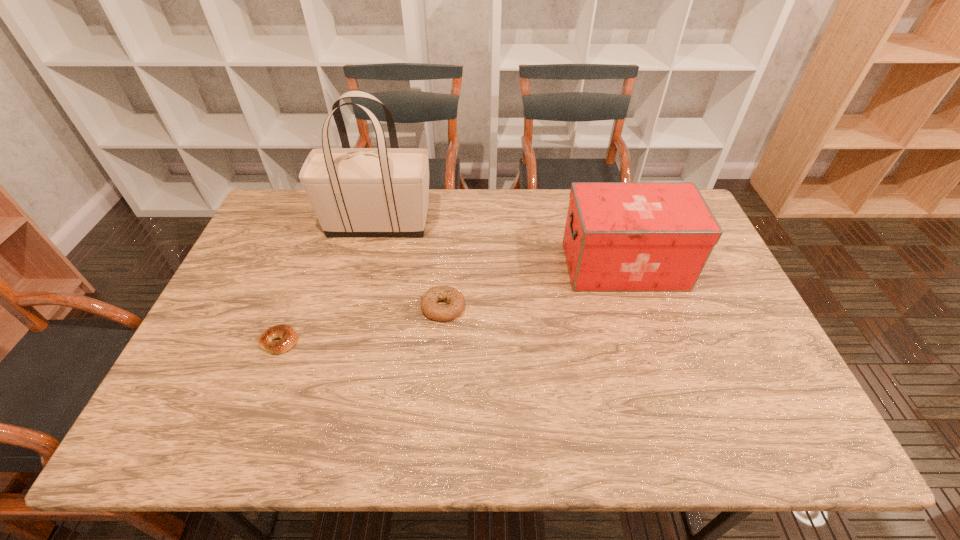
Find the location of `vacant area situated on the handle side of the rightmost object`. vacant area situated on the handle side of the rightmost object is located at coordinates (497, 266).

Image resolution: width=960 pixels, height=540 pixels. I want to click on free space located on the handle side of the rightmost object, so click(507, 266).

Where is `vacant space situated on the front of the second shortest object`? The image size is (960, 540). vacant space situated on the front of the second shortest object is located at coordinates coord(438,376).

Locate an element on the screen. This screenshot has width=960, height=540. vacant space located 0.280m on the right of the shortest object is located at coordinates (408, 341).

Find the location of a particular element. The height and width of the screenshot is (540, 960). object that is at the far edge is located at coordinates (355, 192).

Find the location of a particular element. The width and height of the screenshot is (960, 540). object that is at the left edge is located at coordinates (288, 336).

Where is `object that is positioned at the right edge`? This screenshot has width=960, height=540. object that is positioned at the right edge is located at coordinates (619, 236).

Locate an element on the screen. Image resolution: width=960 pixels, height=540 pixels. free location at the far edge of the desktop is located at coordinates (568, 203).

Find the location of a particular element. This screenshot has width=960, height=540. free space at the near edge of the desktop is located at coordinates (480, 414).

Where is `vacant space at the left edge of the desktop`? This screenshot has height=540, width=960. vacant space at the left edge of the desktop is located at coordinates (240, 363).